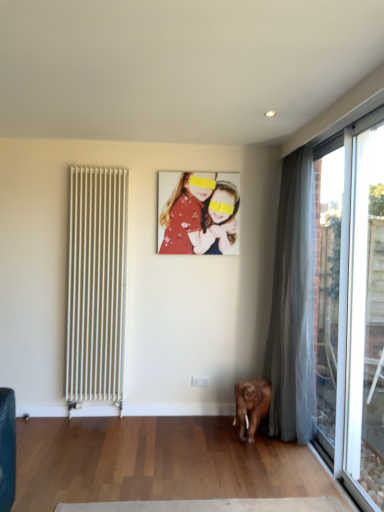
The image size is (384, 512). I want to click on spots to the right of white metal radiator at left, so [134, 422].